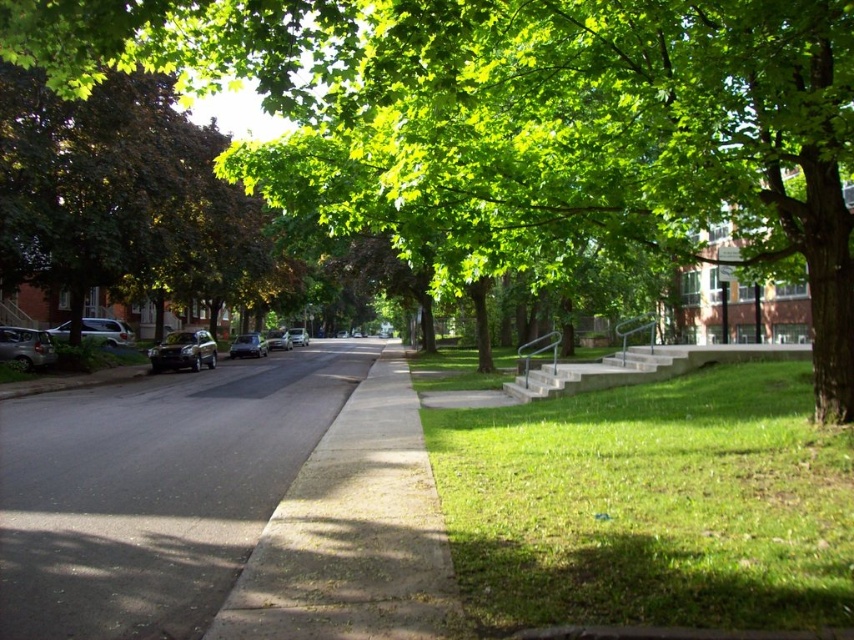
Question: Which point appears farthest from the camera in this image?

Choices:
 (A) (689, 244)
 (B) (179, 227)
 (C) (564, 369)
 (D) (18, 348)

Answer: (B)

Question: Can you confirm if green grass at right is positioned to the left of green leafy tree at left?

Choices:
 (A) yes
 (B) no

Answer: (B)

Question: Does green leafy tree at center have a larger size compared to gray concrete curb at lower left?

Choices:
 (A) yes
 (B) no

Answer: (A)

Question: Based on their relative distances, which object is nearer to the silver metallic sedan at center?

Choices:
 (A) green grass at right
 (B) gray concrete curb at lower left
 (C) silver metallic car at left

Answer: (C)

Question: Estimate the real-world distances between objects in this image. Which object is closer to the green leafy tree at left?

Choices:
 (A) silver metallic car at left
 (B) green grass at right
 (C) gray concrete curb at lower left

Answer: (A)

Question: Is gray concrete sidewalk at center in front of silver metallic car at left?

Choices:
 (A) no
 (B) yes

Answer: (B)